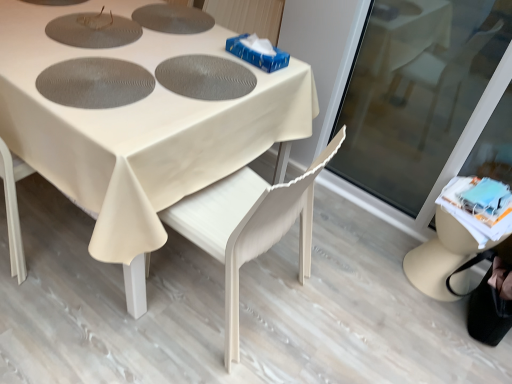
The image size is (512, 384). I want to click on free space to the left of white wood chair at center, so click(x=80, y=303).